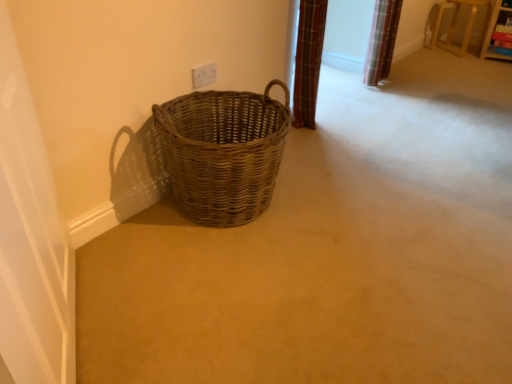
This screenshot has width=512, height=384. In order to click on vacant region to the right of woven brown basket at lower left in this screenshot , I will do `click(347, 204)`.